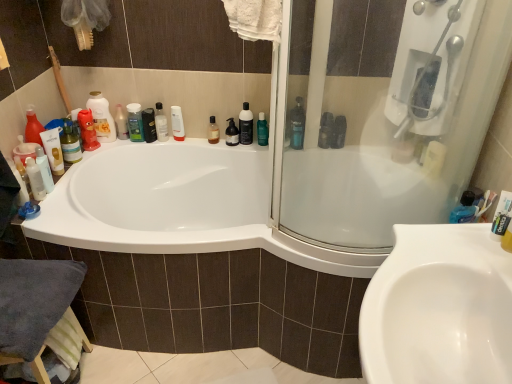
Question: From the image's perspective, is white glossy bottle at upper center, which is the fourth mouthwash from right to left, beneath green matte shampoo at upper left, the second toiletry when ordered from right to left?

Choices:
 (A) no
 (B) yes

Answer: (B)

Question: Could you tell me if white glossy bottle at upper center, which is the fourth mouthwash from right to left, is facing green matte shampoo at upper left, the 2th toiletry positioned from the left?

Choices:
 (A) no
 (B) yes

Answer: (A)

Question: Is white glossy bottle at upper center, which is the fourth mouthwash from right to left, smaller than green matte shampoo at upper left, the 2th toiletry positioned from the left?

Choices:
 (A) yes
 (B) no

Answer: (A)

Question: Would you say white glossy bottle at upper center, which is the fourth mouthwash from right to left, contains green matte shampoo at upper left, the second toiletry when ordered from right to left?

Choices:
 (A) no
 (B) yes

Answer: (A)

Question: Considering the relative positions of white glossy bottle at upper center, which is the fourth mouthwash from right to left, and green matte shampoo at upper left, the 2th toiletry positioned from the left, in the image provided, is white glossy bottle at upper center, which is the fourth mouthwash from right to left, to the right of green matte shampoo at upper left, the 2th toiletry positioned from the left, from the viewer's perspective?

Choices:
 (A) no
 (B) yes

Answer: (B)

Question: Is white glossy bottle at upper center, which is the fourth mouthwash from right to left, completely or partially outside of green matte shampoo at upper left, the second toiletry when ordered from right to left?

Choices:
 (A) yes
 (B) no

Answer: (A)

Question: From the image's perspective, is green matte shampoo at upper left, the second toiletry when ordered from right to left, located above white matte toothpaste at right?

Choices:
 (A) no
 (B) yes

Answer: (B)

Question: Considering the relative sizes of green matte shampoo at upper left, the second toiletry when ordered from right to left, and white matte toothpaste at right in the image provided, is green matte shampoo at upper left, the second toiletry when ordered from right to left, thinner than white matte toothpaste at right?

Choices:
 (A) yes
 (B) no

Answer: (B)

Question: Could you tell me if green matte shampoo at upper left, the second toiletry when ordered from right to left, is turned towards white matte toothpaste at right?

Choices:
 (A) yes
 (B) no

Answer: (B)

Question: Is green matte shampoo at upper left, the second toiletry when ordered from right to left, positioned far away from white matte toothpaste at right?

Choices:
 (A) yes
 (B) no

Answer: (A)

Question: Can you confirm if green matte shampoo at upper left, the 2th toiletry positioned from the left, is positioned to the left of white matte toothpaste at right?

Choices:
 (A) yes
 (B) no

Answer: (A)

Question: Is green matte shampoo at upper left, the 2th toiletry positioned from the left, wider than white matte toothpaste at right?

Choices:
 (A) yes
 (B) no

Answer: (A)

Question: Is black pump bottle at upper center, which ranks as the 1th toiletry in right-to-left order, aimed at green matte shampoo at upper left, the second toiletry when ordered from right to left?

Choices:
 (A) yes
 (B) no

Answer: (B)